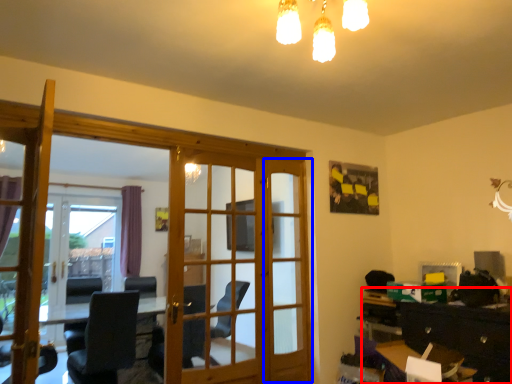
Question: Which of the following is the closest to the observer, dresser (highlighted by a red box) or screen door (highlighted by a blue box)?

Choices:
 (A) dresser
 (B) screen door

Answer: (A)